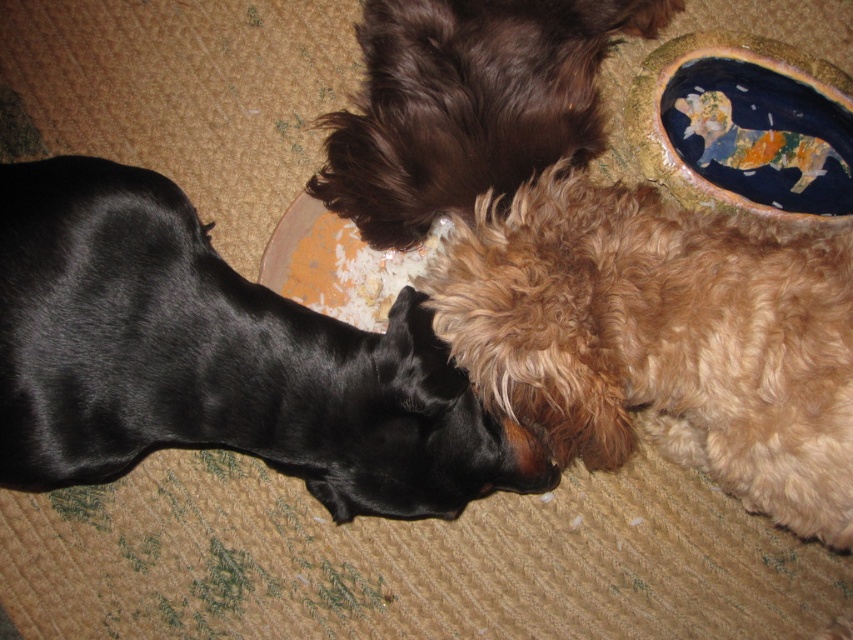
Question: Which point is closer to the camera?

Choices:
 (A) brown fluffy dog at upper center
 (B) black shiny fur dog at lower left
 (C) fuzzy brown dog at center

Answer: (C)

Question: Which object is closer to the camera taking this photo?

Choices:
 (A) brown fluffy dog at upper center
 (B) fuzzy brown dog at center
 (C) black shiny fur dog at lower left

Answer: (B)

Question: From the image, what is the correct spatial relationship of black shiny fur dog at lower left in relation to brown fluffy dog at upper center?

Choices:
 (A) below
 (B) above

Answer: (A)

Question: Which of the following is the farthest from the observer?

Choices:
 (A) (807, 317)
 (B) (408, 67)
 (C) (106, 426)

Answer: (B)

Question: Can you confirm if black shiny fur dog at lower left is wider than fuzzy brown dog at center?

Choices:
 (A) yes
 (B) no

Answer: (A)

Question: From the image, what is the correct spatial relationship of fuzzy brown dog at center in relation to brown fluffy dog at upper center?

Choices:
 (A) right
 (B) left

Answer: (A)